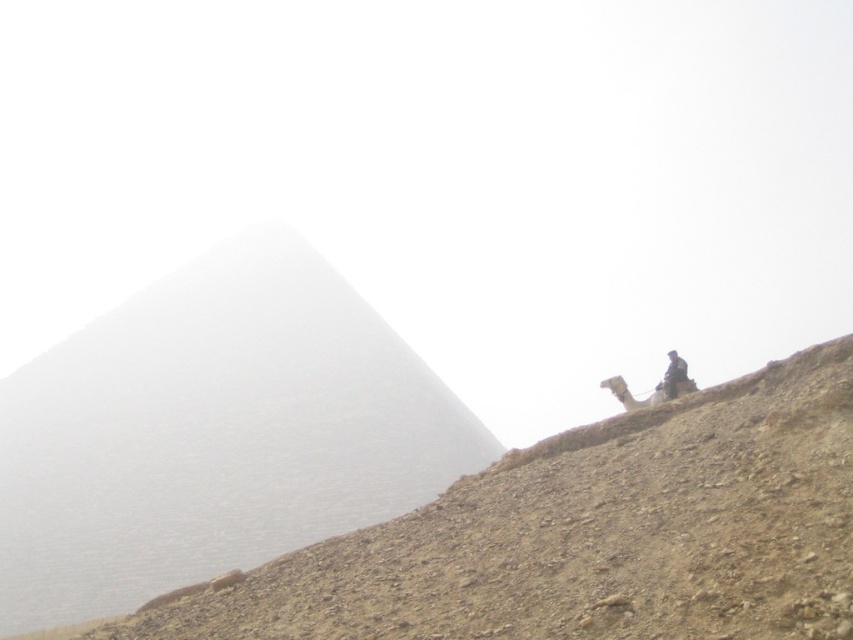
Can you confirm if gray stone pyramid at upper left is smaller than dark brown leather jacket at upper right?

No, gray stone pyramid at upper left is not smaller than dark brown leather jacket at upper right.

Can you confirm if gray stone pyramid at upper left is shorter than dark brown leather jacket at upper right?

Incorrect, gray stone pyramid at upper left's height does not fall short of dark brown leather jacket at upper right's.

This screenshot has height=640, width=853. Describe the element at coordinates (213, 433) in the screenshot. I see `gray stone pyramid at upper left` at that location.

Where is `gray stone pyramid at upper left`? The image size is (853, 640). gray stone pyramid at upper left is located at coordinates (213, 433).